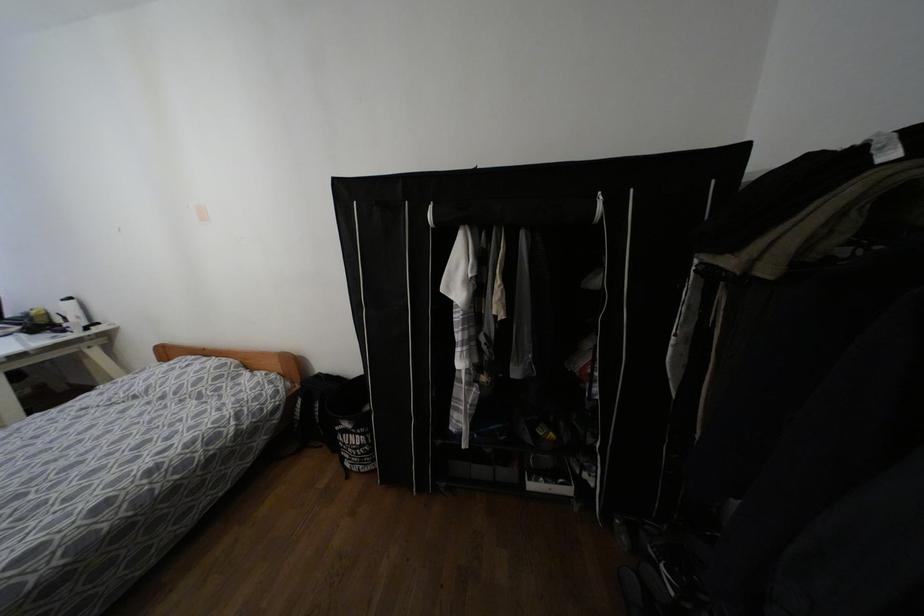
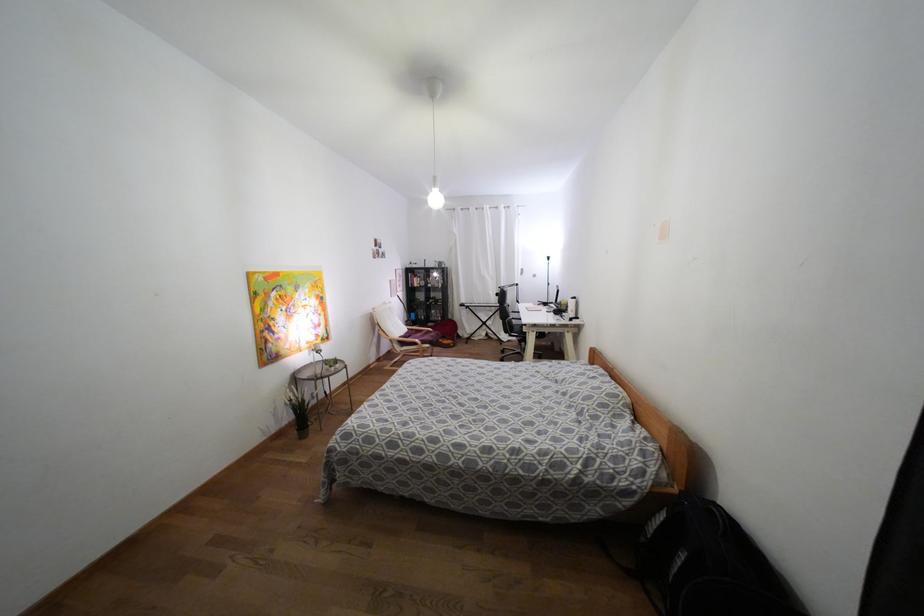
Question: The camera is either moving clockwise (left) or counter-clockwise (right) around the object. The first image is from the beginning of the video and the second image is from the end. Is the camera moving left or right when shooting the video?

Choices:
 (A) Left
 (B) Right

Answer: (B)